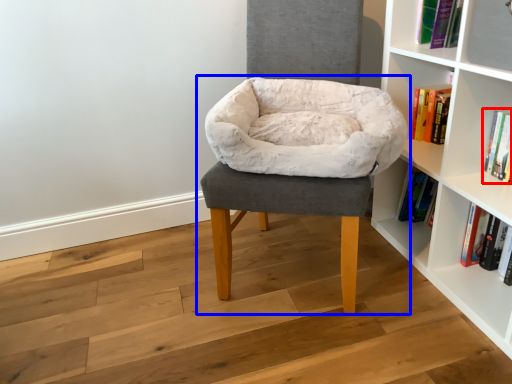
Question: Which of the following is the farthest to the observer, book (highlighted by a red box) or chair (highlighted by a blue box)?

Choices:
 (A) book
 (B) chair

Answer: (A)